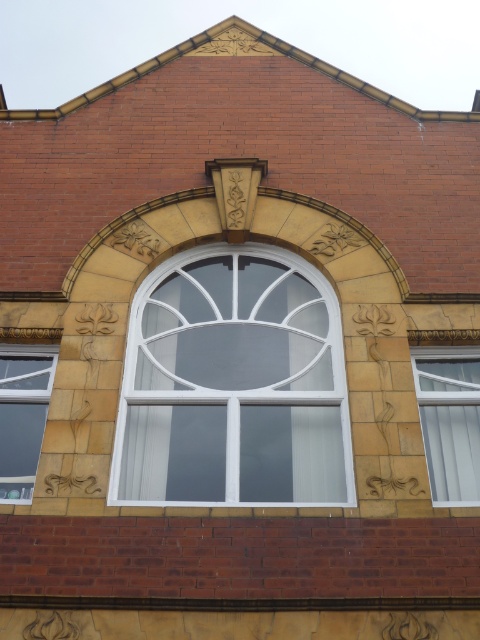
Is point (452, 445) closer to viewer compared to point (38, 346)?

Yes, point (452, 445) is in front of point (38, 346).

Does point (470, 493) come farther from viewer compared to point (35, 444)?

No, (470, 493) is closer to viewer.

Where is `white plastic window at right`? Image resolution: width=480 pixels, height=640 pixels. white plastic window at right is located at coordinates (450, 420).

Where is `white glass window at center`? white glass window at center is located at coordinates (233, 384).

Between point (208, 301) and point (8, 492), which one is positioned behind?

The point (208, 301) is behind.

Where is `white glass window at center`? The width and height of the screenshot is (480, 640). white glass window at center is located at coordinates (233, 384).

Is white glass window at center smaller than white plastic window at right?

Incorrect, white glass window at center is not smaller in size than white plastic window at right.

Is white glass window at center to the right of white plastic window at right from the viewer's perspective?

No, white glass window at center is not to the right of white plastic window at right.

Between point (220, 376) and point (431, 385), which one is positioned in front?

Point (431, 385) is in front.

I want to click on white glass window at center, so click(x=233, y=384).